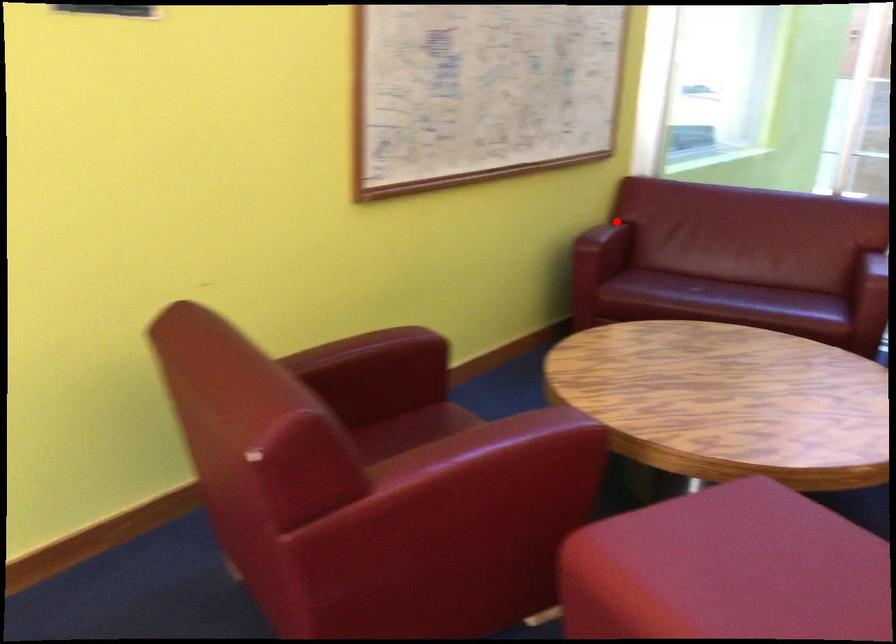
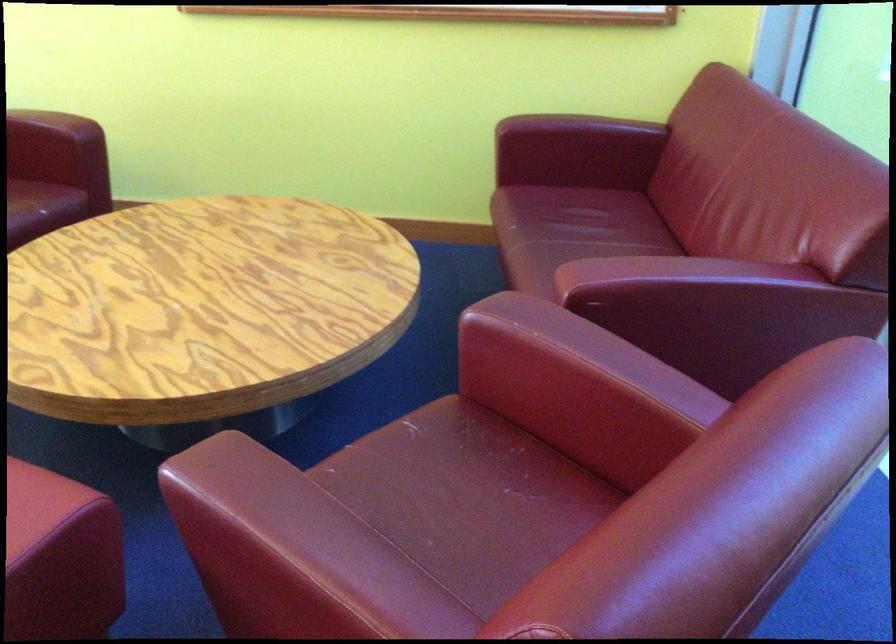
Find the pixel in the second image that matches the highlighted location in the first image.

(582, 127)